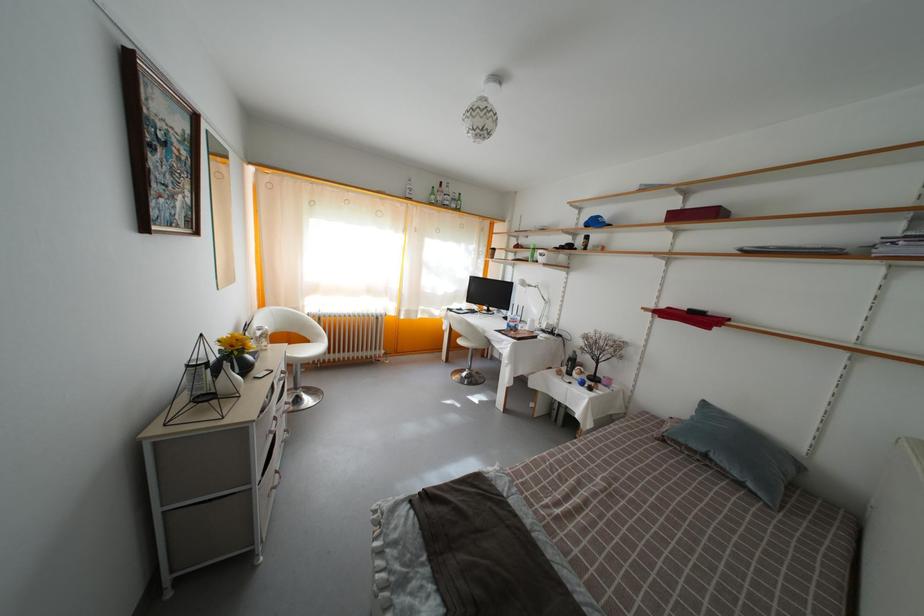
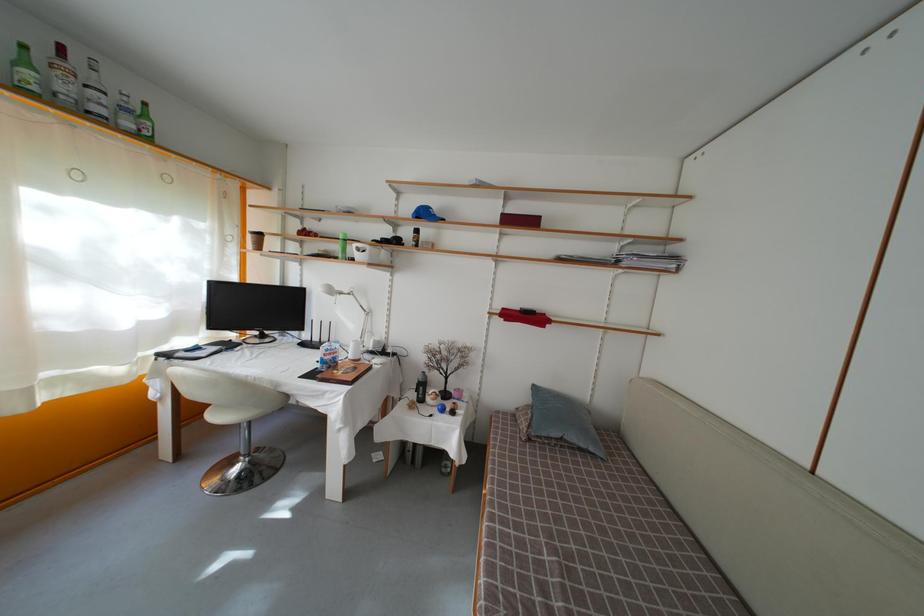
In the second image, find the point that corresponds to point (439, 200) in the first image.

(31, 69)